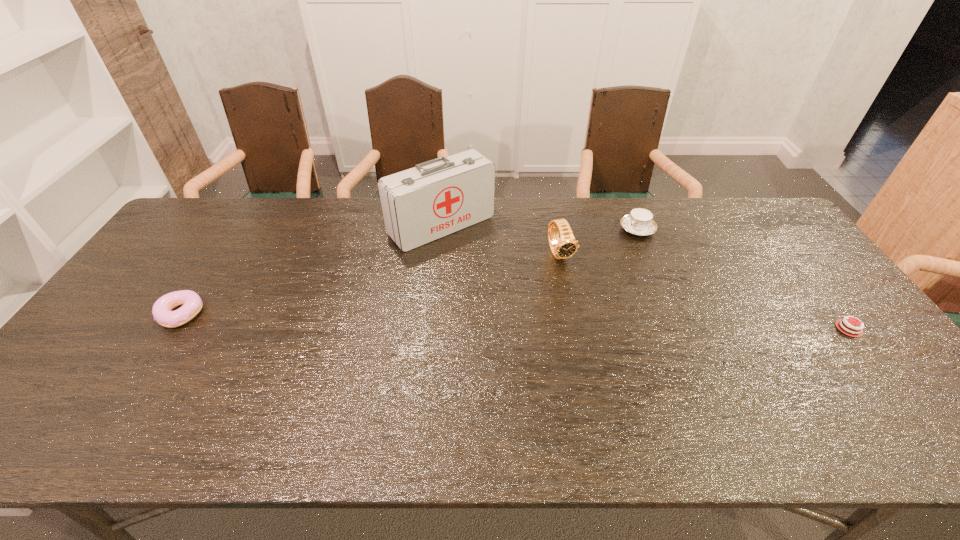
This screenshot has width=960, height=540. What are the coordinates of `free space located 0.050m on the side with the handle of the teacup` in the screenshot? It's located at (618, 244).

Identify the location of the first-aid kit located in the far edge section of the desktop. The width and height of the screenshot is (960, 540). (435, 198).

The width and height of the screenshot is (960, 540). What are the coordinates of `teacup at the far edge` in the screenshot? It's located at (639, 222).

In order to click on object that is at the left edge in this screenshot , I will do `click(191, 301)`.

Locate an element on the screen. object that is positioned at the right edge is located at coordinates (847, 328).

What are the coordinates of `vacant space at the far edge of the desktop` in the screenshot? It's located at (243, 212).

The image size is (960, 540). In the image, there is a desktop. Identify the location of vacant space at the near edge. (823, 387).

You are a GUI agent. You are given a task and a screenshot of the screen. Output one action in this format:
    pyautogui.click(x=<x>, y=<y>)
    Task: Click on the vacant point at the right edge
    This screenshot has width=960, height=540.
    Given the screenshot: What is the action you would take?
    pyautogui.click(x=870, y=366)

Where is `vacant space at the near left corner`? This screenshot has width=960, height=540. vacant space at the near left corner is located at coordinates (75, 380).

Identify the location of vacant area between the shortest object and the fourth object from right to left. The height and width of the screenshot is (540, 960). point(645,277).